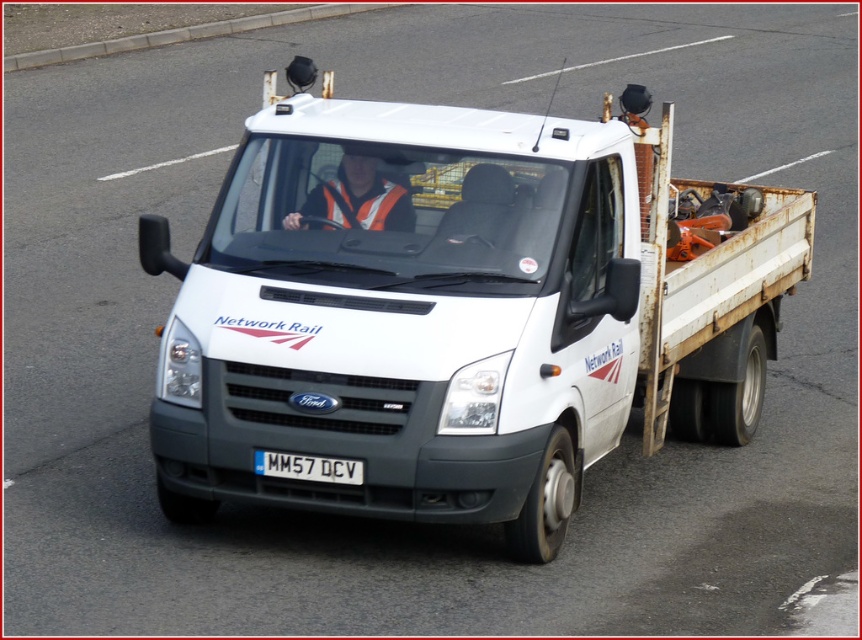
Is white matte truck at center above white plastic license plate at center?

Correct, white matte truck at center is located above white plastic license plate at center.

Does point (398, 278) lie behind point (275, 458)?

Yes.

Is point (478, 348) farther from viewer compared to point (272, 464)?

No, (478, 348) is closer to viewer.

Image resolution: width=862 pixels, height=640 pixels. I want to click on white matte truck at center, so click(x=463, y=314).

Does white matte truck at center have a lesser height compared to reflective orange vest at center?

Incorrect, white matte truck at center's height does not fall short of reflective orange vest at center's.

Is point (288, 284) farther from viewer compared to point (391, 196)?

No, it is not.

Find the location of a particular element. white matte truck at center is located at coordinates (463, 314).

Can you confirm if reflective orange vest at center is positioned to the right of white plastic license plate at center?

Correct, you'll find reflective orange vest at center to the right of white plastic license plate at center.

Is point (345, 198) in front of point (275, 474)?

No, (345, 198) is behind (275, 474).

Where is `reflective orange vest at center`? reflective orange vest at center is located at coordinates (358, 196).